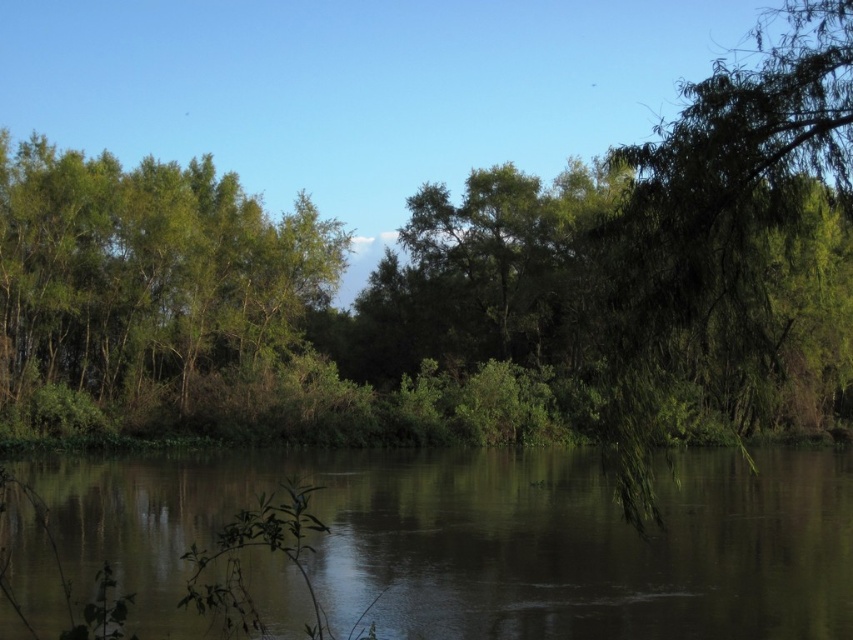
You are standing at the edge of the scene and want to reach the brown reflective water at center. Which direction should you move in to get there?

Since the brown reflective water at center is located at point coordinates of 0.845 on the x axis and 0.573 on the y axis, you should move towards the right and slightly forward to reach it.

Based on the photo, you are standing on the edge of the brown reflective water at center and want to see the green leafy tree at right. Can you see the entire tree without moving your position?

The green leafy tree at right is behind the brown reflective water at center, so part of it might be hidden by the water. You might not see the entire tree from your current position.

Consider the image. You are standing at the edge of the water in the serene natural scene. You notice a point marked at coordinates point (488, 540). What does this point represent in the scene?

The point (488, 540) represents the location of the brown reflective water at center in the scene.